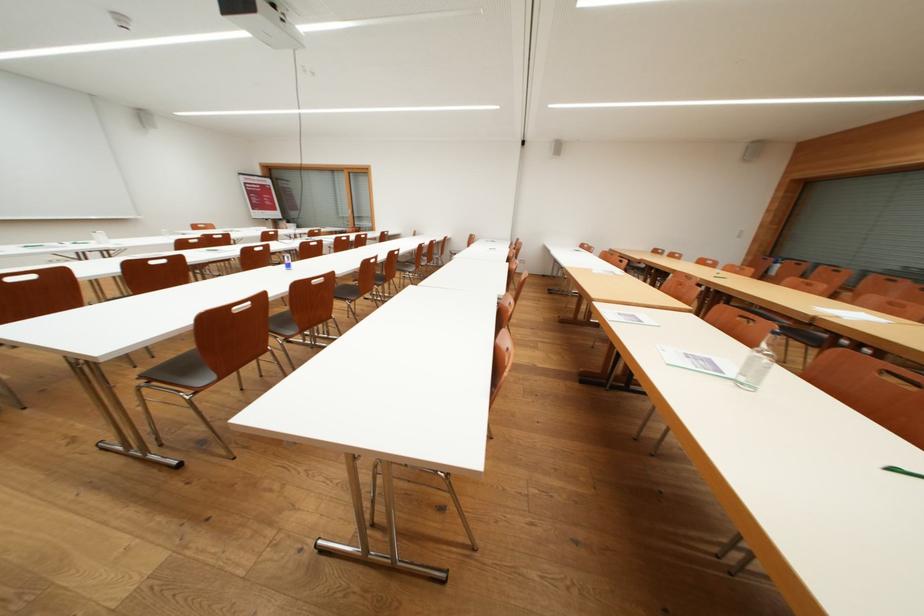
Which object does [757,363] point to?

This point indicates the glass water bottle.